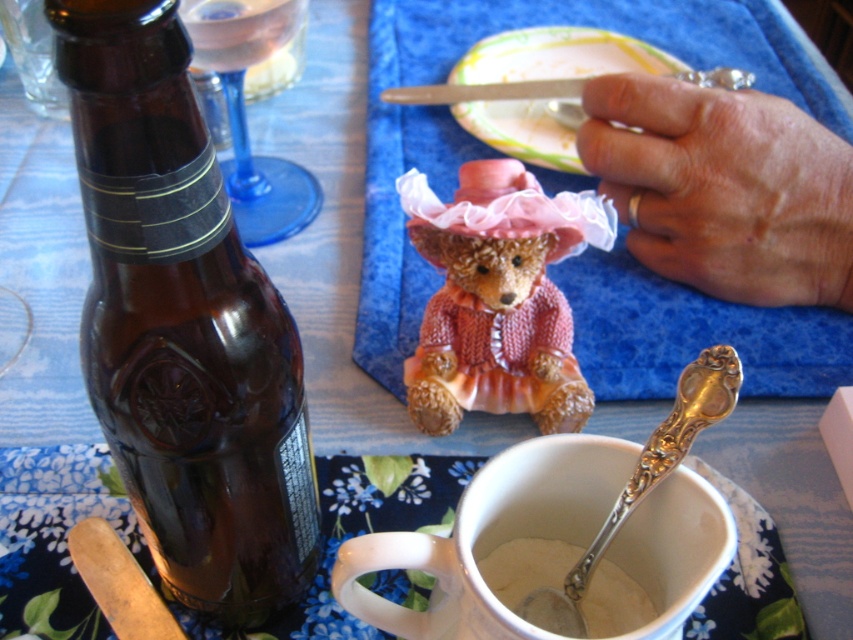
Is pink fabric figurine at center taller than smooth skin hand at upper right?

Yes.

The image size is (853, 640). I want to click on pink fabric figurine at center, so click(508, 154).

Does smooth skin hand at upper right appear on the left side of white creamy substance at cup center?

Incorrect, smooth skin hand at upper right is not on the left side of white creamy substance at cup center.

Is point (758, 209) in front of point (608, 611)?

No, it is behind (608, 611).

Between point (647, 100) and point (604, 636), which one is positioned in front?

Point (604, 636) is in front.

Where is `smooth skin hand at upper right`? Image resolution: width=853 pixels, height=640 pixels. smooth skin hand at upper right is located at coordinates coord(724,188).

Can you confirm if smooth skin hand at upper right is thinner than white ceramic mug at lower center?

In fact, smooth skin hand at upper right might be wider than white ceramic mug at lower center.

What do you see at coordinates (724, 188) in the screenshot? I see `smooth skin hand at upper right` at bounding box center [724, 188].

Locate an element on the screen. This screenshot has width=853, height=640. smooth skin hand at upper right is located at coordinates (724, 188).